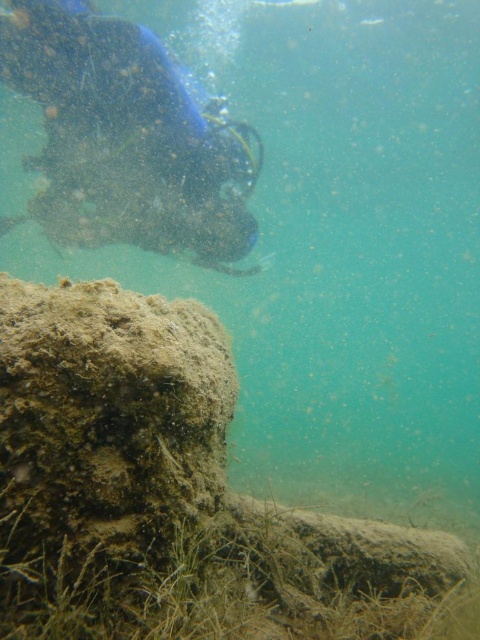
You are a scuba diver preparing to place a marker at point [106,435]. The marker is 10 cm in diameter. Can you determine if there is enough space to place it there?

At point [106,435] lies brown mossy rock at lower left. The marker cannot be placed there as the location is occupied by the rock.

You are a scuba diver preparing to take a photo of the point at coordinates (82, 355). If your camera has a maximum focus range of 1.2 meters, will you be able to capture the point clearly?

The point at coordinates (82, 355) is 1.16 meters away from the camera, which is within the maximum focus range of 1.2 meters. Therefore, you can capture the point clearly.